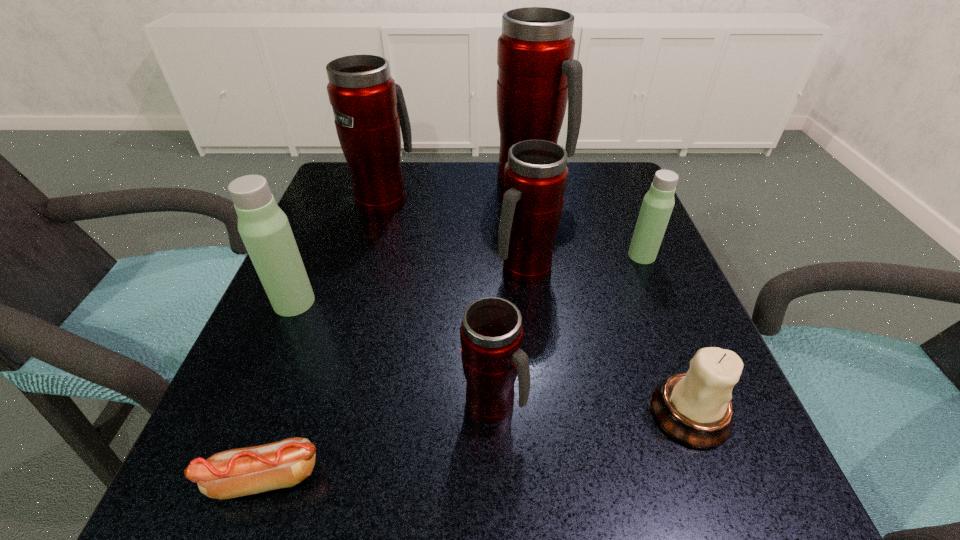
Locate an element on the screen. The image size is (960, 540). the tallest thermos bottle is located at coordinates (537, 75).

Locate an element on the screen. the tallest object is located at coordinates (537, 75).

Locate an element on the screen. This screenshot has width=960, height=540. the fifth shortest thermos bottle is located at coordinates (369, 108).

The image size is (960, 540). I want to click on the fifth thermos bottle from right to left, so click(x=369, y=108).

Where is `the second smallest red thermos bottle`? the second smallest red thermos bottle is located at coordinates (535, 177).

This screenshot has height=540, width=960. Identify the location of the leftmost thermos bottle. (264, 228).

Locate an element on the screen. the nearer light thermos bottle is located at coordinates (264, 228).

Find the location of a particular element. The height and width of the screenshot is (540, 960). the rightmost thermos bottle is located at coordinates (658, 203).

Identify the location of the smaller light thermos bottle. (658, 203).

This screenshot has height=540, width=960. Find the location of `the nearest thermos bottle`. the nearest thermos bottle is located at coordinates (491, 334).